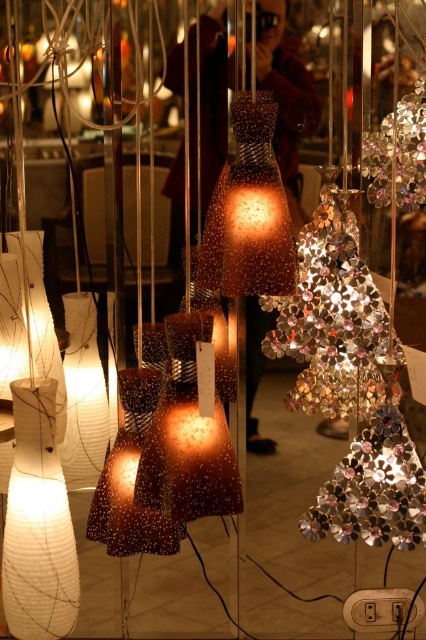
Is point (368, 349) positioned after point (374, 164)?

No, (368, 349) is closer to viewer.

The width and height of the screenshot is (426, 640). I want to click on shiny metallic ornament at center, so click(331, 320).